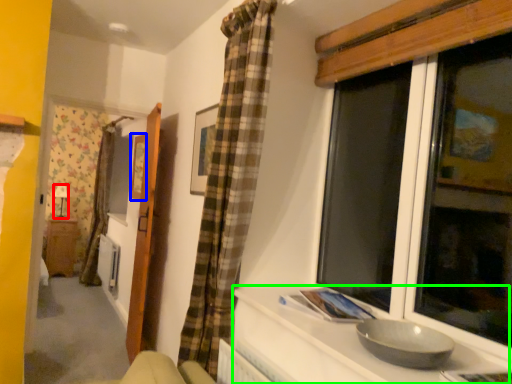
Question: Which is farther away from lamp (highlighted by a red box)? picture frame (highlighted by a blue box) or counter top (highlighted by a green box)?

Choices:
 (A) picture frame
 (B) counter top

Answer: (B)